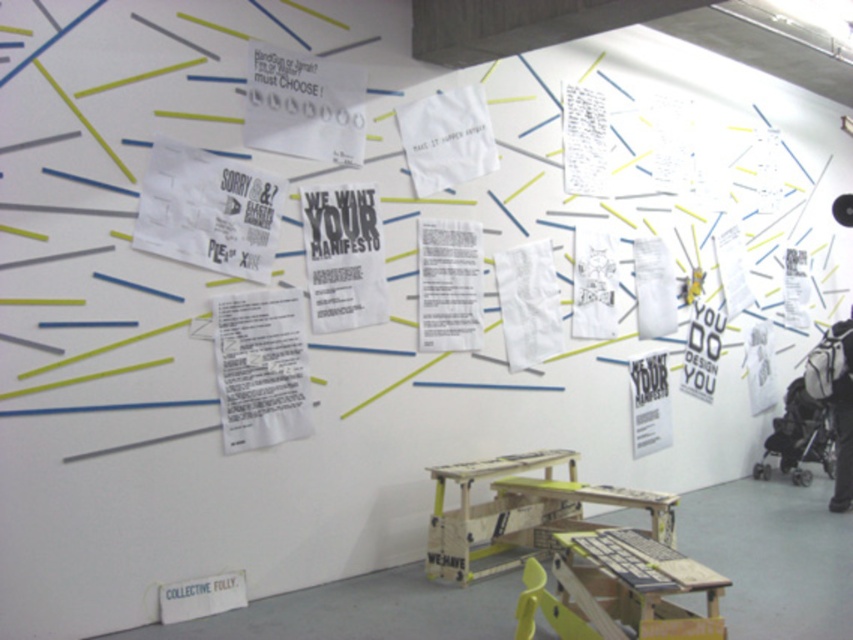
Is white paper at upper center thinner than white paper at center?

In fact, white paper at upper center might be wider than white paper at center.

Is point (456, 113) closer to viewer compared to point (527, 296)?

Yes.

Identify the location of white paper at upper center. Image resolution: width=853 pixels, height=640 pixels. (445, 138).